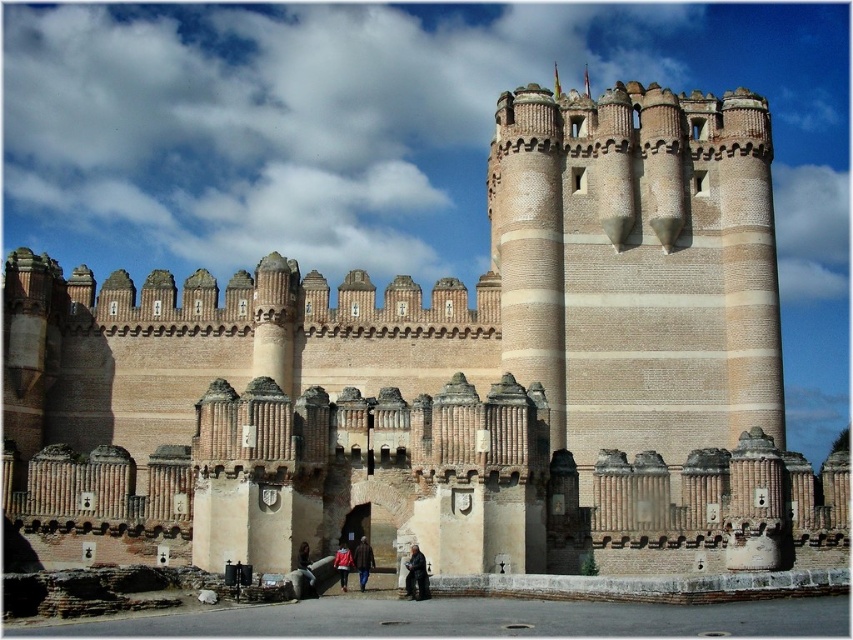
Question: Which of the following is the closest to the observer?

Choices:
 (A) (364, 547)
 (B) (427, 592)

Answer: (B)

Question: Estimate the real-world distances between objects in this image. Which object is closer to the red jacket at center?

Choices:
 (A) dark brown leather jacket at lower center
 (B) brown leather jacket at center

Answer: (B)

Question: Does dark brown leather jacket at lower center come behind red jacket at center?

Choices:
 (A) no
 (B) yes

Answer: (A)

Question: Which of the following is the closest to the observer?

Choices:
 (A) (419, 568)
 (B) (337, 548)

Answer: (A)

Question: Does dark brown leather jacket at lower center have a lesser width compared to red jacket at center?

Choices:
 (A) no
 (B) yes

Answer: (A)

Question: Is dark brown leather jacket at lower center closer to camera compared to red jacket at center?

Choices:
 (A) no
 (B) yes

Answer: (B)